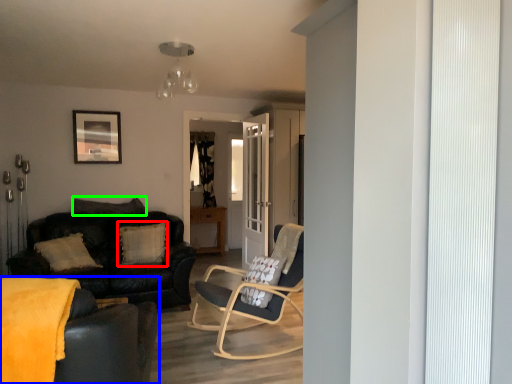
Question: Which object is positioned farthest from pillow (highlighted by a red box)? Select from studio couch (highlighted by a blue box) and pillow (highlighted by a green box).

Choices:
 (A) studio couch
 (B) pillow

Answer: (A)